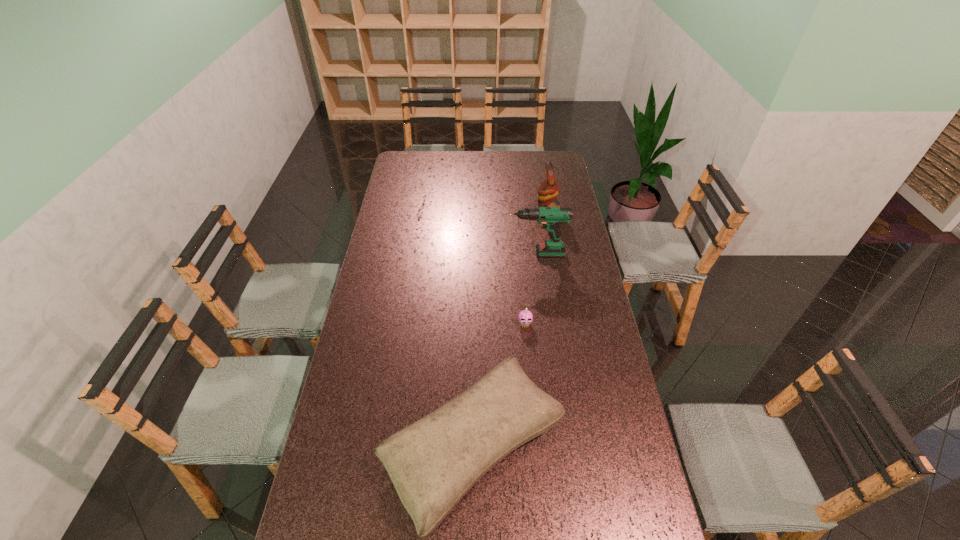
This screenshot has height=540, width=960. I want to click on parrot, so click(549, 189).

Locate an element on the screen. This screenshot has height=540, width=960. drill is located at coordinates (551, 218).

The image size is (960, 540). In order to click on cupcake in this screenshot , I will do `click(525, 317)`.

This screenshot has height=540, width=960. In order to click on the second nearest object in this screenshot , I will do `click(525, 317)`.

You are a GUI agent. You are given a task and a screenshot of the screen. Output one action in this format:
    pyautogui.click(x=<x>, y=<y>)
    Task: Click on the free region located on the face of the farthest object
    The height and width of the screenshot is (540, 960).
    Given the screenshot: What is the action you would take?
    pyautogui.click(x=458, y=210)

Identify the location of vacant space located 0.190m on the face of the farthest object. (495, 210).

Where is `vacant space located 0.130m on the face of the farthest object`? This screenshot has height=540, width=960. vacant space located 0.130m on the face of the farthest object is located at coordinates (508, 210).

Find the location of `vacant space located on the handle side of the third nearest object`. vacant space located on the handle side of the third nearest object is located at coordinates (420, 253).

This screenshot has height=540, width=960. In order to click on free spot located 0.230m on the handle side of the third nearest object in this screenshot , I will do `click(447, 253)`.

Locate an element on the screen. Image resolution: width=960 pixels, height=540 pixels. vacant region located 0.090m on the handle side of the third nearest object is located at coordinates (480, 253).